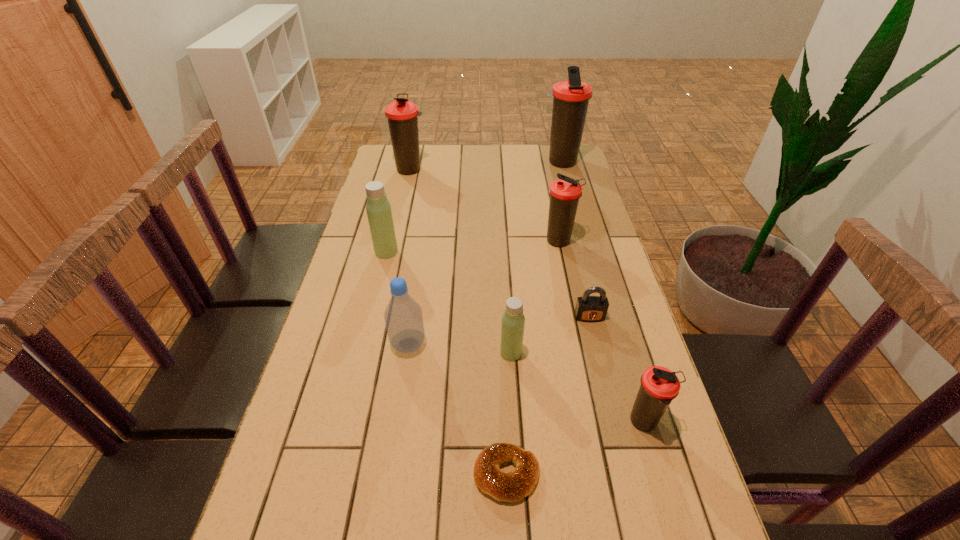
Locate an element on the screen. Image resolution: width=960 pixels, height=540 pixels. free point located on the back of the bottle is located at coordinates (417, 291).

Image resolution: width=960 pixels, height=540 pixels. I want to click on free spot located 0.280m on the back of the eighth farthest object, so click(x=612, y=313).

This screenshot has height=540, width=960. Find the location of `vacant space situated on the back of the fifth farthest thermos bottle`. vacant space situated on the back of the fifth farthest thermos bottle is located at coordinates (509, 318).

Locate an element on the screen. vacant space located on the front of the fifth farthest object near the keyhole is located at coordinates (600, 360).

Find the location of a particular element. vacant space positioned on the left of the shortest object is located at coordinates (372, 475).

Locate an element on the screen. padlock that is at the right edge is located at coordinates (588, 308).

Image resolution: width=960 pixels, height=540 pixels. Find the location of `object that is at the far left corner`. object that is at the far left corner is located at coordinates pos(402,114).

At what (x,y) coordinates should I click in order to perform the action: click on object located in the far right corner section of the desktop. Please return your answer as a coordinate pair (x, y). Looking at the image, I should click on (571, 98).

The width and height of the screenshot is (960, 540). What are the coordinates of `free point at the far edge` in the screenshot? It's located at (435, 153).

The height and width of the screenshot is (540, 960). I want to click on vacant point at the left edge, so click(x=305, y=433).